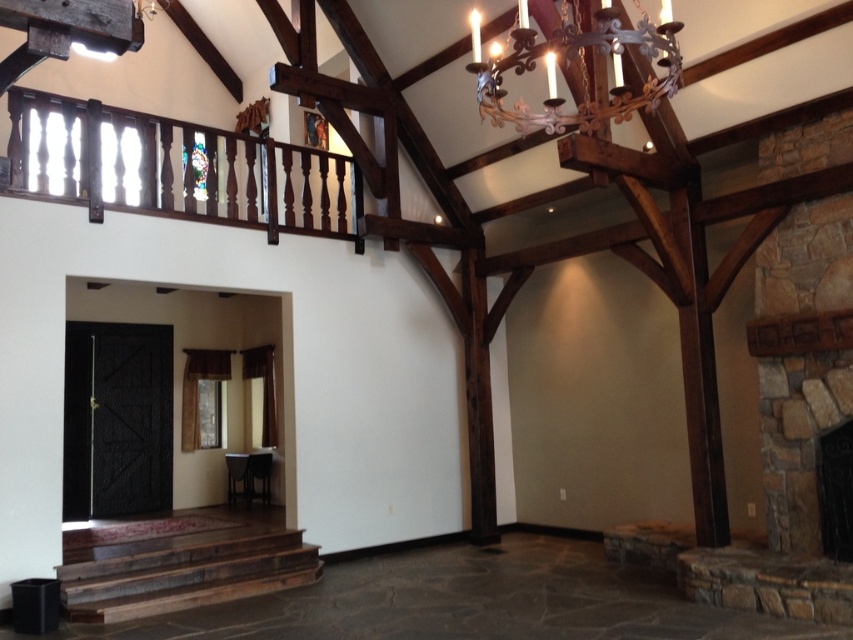
Between dark wood balustrade at upper left and wrought iron chandelier at upper center, which one appears on the right side from the viewer's perspective?

Positioned to the right is wrought iron chandelier at upper center.

Which is more to the left, dark wood balustrade at upper left or wrought iron chandelier at upper center?

Positioned to the left is dark wood balustrade at upper left.

I want to click on dark wood balustrade at upper left, so click(x=173, y=168).

Who is more distant from viewer, (x=161, y=120) or (x=67, y=541)?

The point (x=67, y=541) is more distant.

Who is more distant from viewer, (254,198) or (126,548)?

The point (254,198) is more distant.

Identify the location of dark wood balustrade at upper left. (173, 168).

Does wrought iron chandelier at upper center appear over dark stone fireplace at right?

Yes.

Which of these two, wrought iron chandelier at upper center or dark stone fireplace at right, stands shorter?

dark stone fireplace at right is shorter.

Between point (606, 106) and point (849, 557), which one is positioned in front?

Point (849, 557)

Locate an element on the screen. Image resolution: width=853 pixels, height=640 pixels. wrought iron chandelier at upper center is located at coordinates (579, 67).